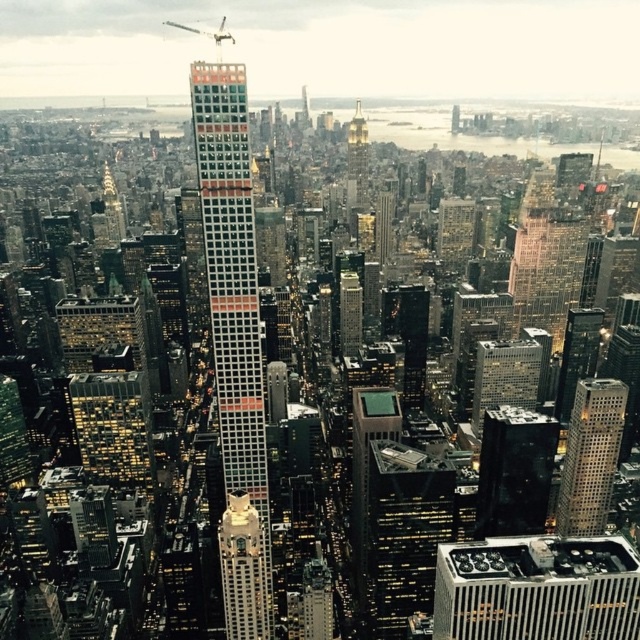
Is black glass building at center positioned before gold reflective spire at center?

No, black glass building at center is behind gold reflective spire at center.

Is point (538, 529) positioned after point (362, 124)?

Yes, point (538, 529) is farther from viewer.

Where is `black glass building at center`? This screenshot has width=640, height=640. black glass building at center is located at coordinates (515, 472).

Locate an element on the screen. The height and width of the screenshot is (640, 640). black glass building at center is located at coordinates (515, 472).

Can you confirm if black glass building at center is wider than silver metallic skyscraper at center-right?

Indeed, black glass building at center has a greater width compared to silver metallic skyscraper at center-right.

The width and height of the screenshot is (640, 640). Describe the element at coordinates (515, 472) in the screenshot. I see `black glass building at center` at that location.

What are the coordinates of `black glass building at center` in the screenshot? It's located at (515, 472).

Which is more to the left, white glass skyscraper at center or gold textured owl at center?

Result: white glass skyscraper at center is more to the left.

Who is more distant from viewer, (244, 202) or (243, 516)?

Point (243, 516)

You are a GUI agent. You are given a task and a screenshot of the screen. Output one action in this format:
    pyautogui.click(x=<x>, y=<y>)
    Task: Click on the white glass skyscraper at center
    
    Given the screenshot: What is the action you would take?
    pyautogui.click(x=232, y=289)